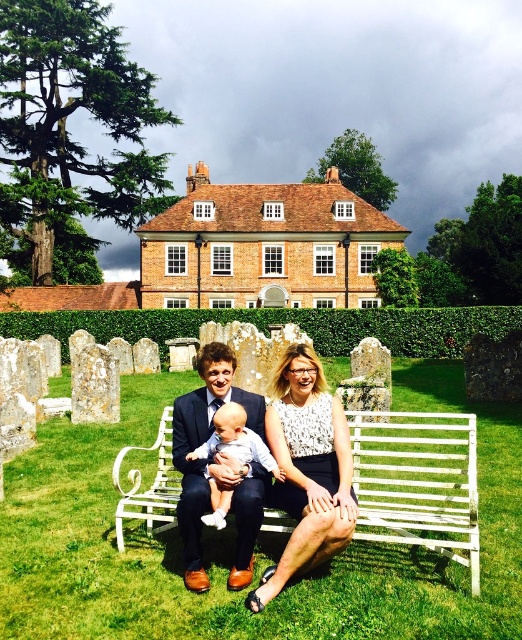
Who is positioned more to the left, white metal bench at center or matte black suit at center?

matte black suit at center is more to the left.

Who is more forward, (162, 468) or (235, 481)?

Positioned in front is point (235, 481).

You are a GUI agent. You are given a task and a screenshot of the screen. Output one action in this format:
    pyautogui.click(x=<x>, y=<y>)
    Task: Click on the white metal bench at center
    
    Given the screenshot: What is the action you would take?
    pyautogui.click(x=418, y=481)

Between white lace blouse at center and light blue fabric baby at center, which one appears on the right side from the viewer's perspective?

white lace blouse at center is more to the right.

How distant is white lace blouse at center from light blue fabric baby at center?

A distance of 13.12 feet exists between white lace blouse at center and light blue fabric baby at center.

Identify the location of white lace blouse at center. The height and width of the screenshot is (640, 522). (306, 468).

Can you confirm if white lace blouse at center is shorter than matte black suit at center?

In fact, white lace blouse at center may be taller than matte black suit at center.

Is white lace blouse at center closer to the viewer compared to matte black suit at center?

Yes, white lace blouse at center is in front of matte black suit at center.

Between point (317, 481) and point (256, 504), which one is positioned behind?

Point (317, 481)

Identify the location of white lace blouse at center. The image size is (522, 640). (306, 468).